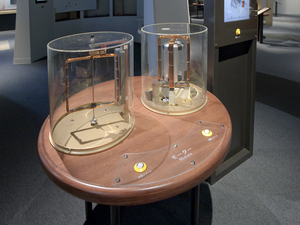
I want to click on wall, so click(38, 28).